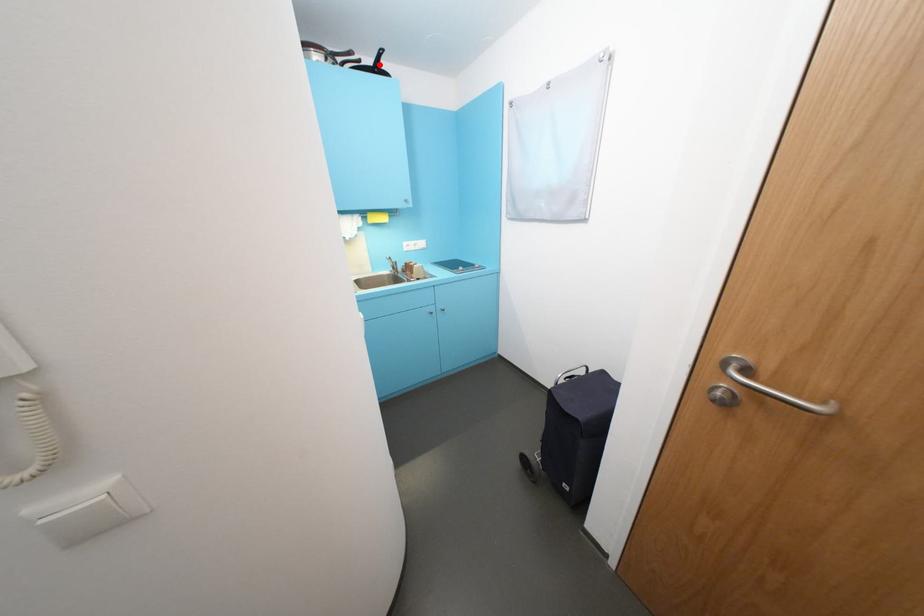
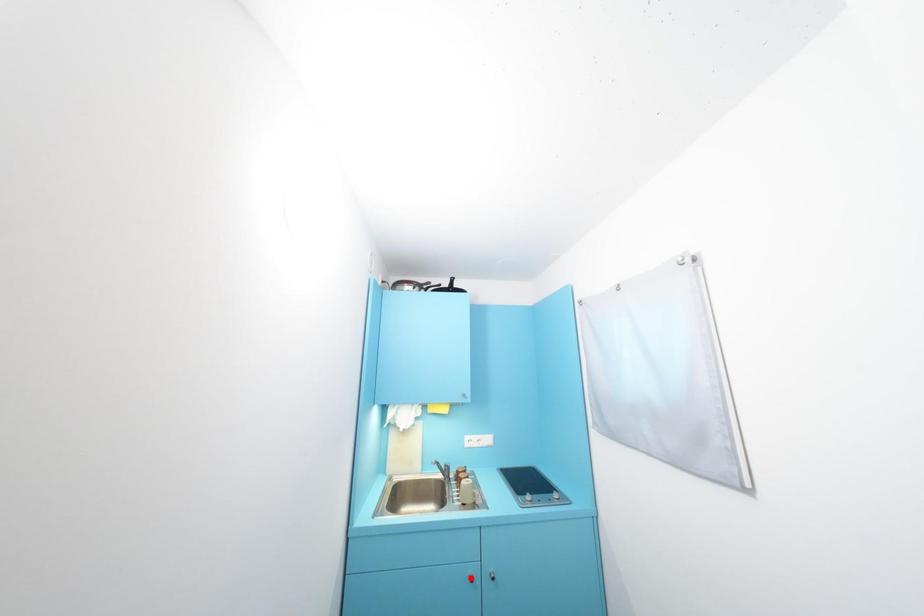
I am providing you with two images of the same scene from different viewpoints. A red point is marked on the first image and another point is marked on the second image. Are the points marked in image1 and image2 representing the same 3D position?

No